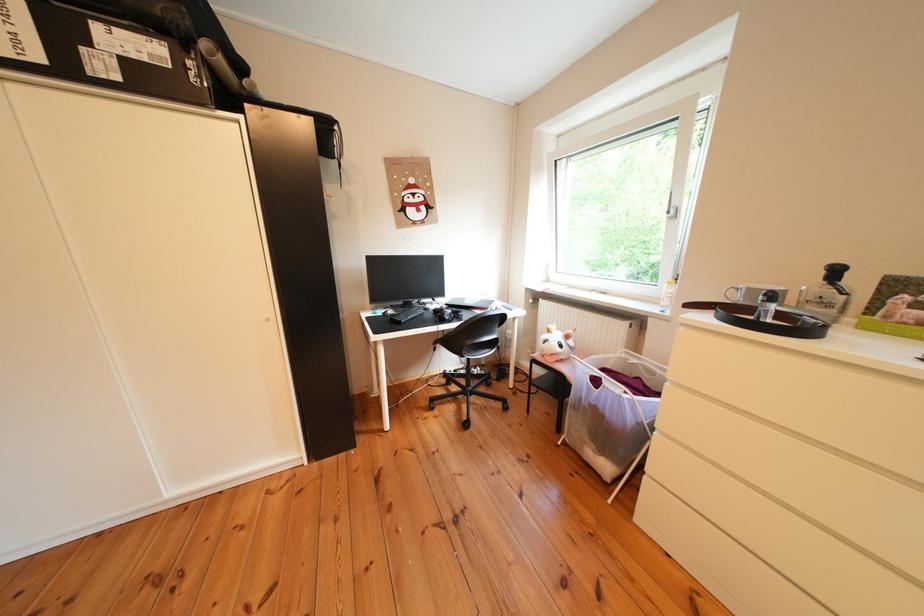
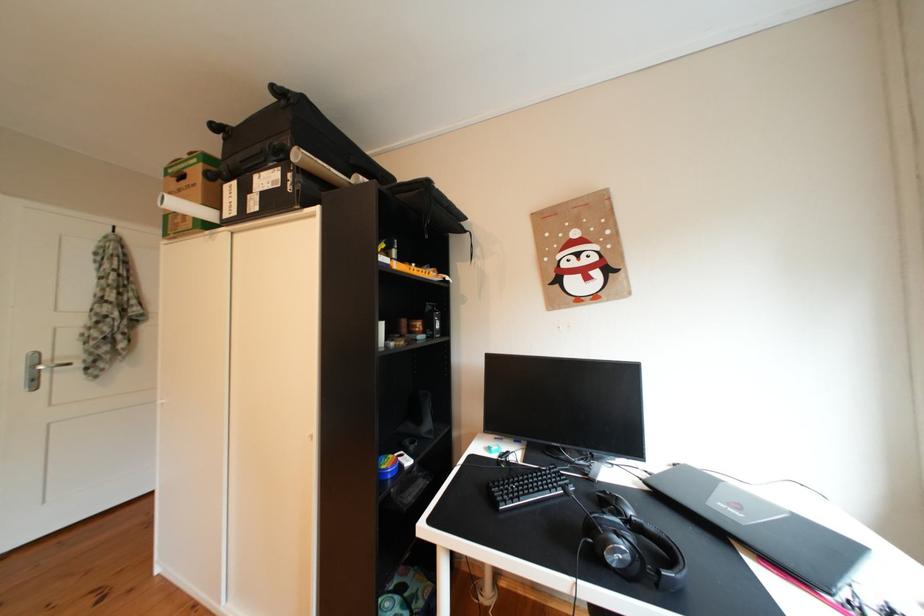
Question: The camera is either moving clockwise (left) or counter-clockwise (right) around the object. The first image is from the beginning of the video and the second image is from the end. Is the camera moving left or right when shooting the video?

Choices:
 (A) Left
 (B) Right

Answer: (B)